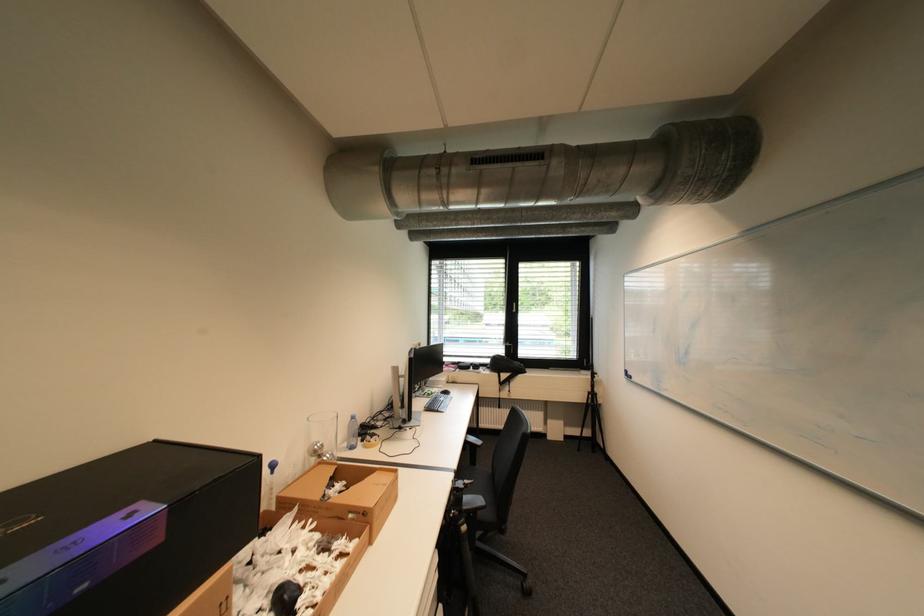
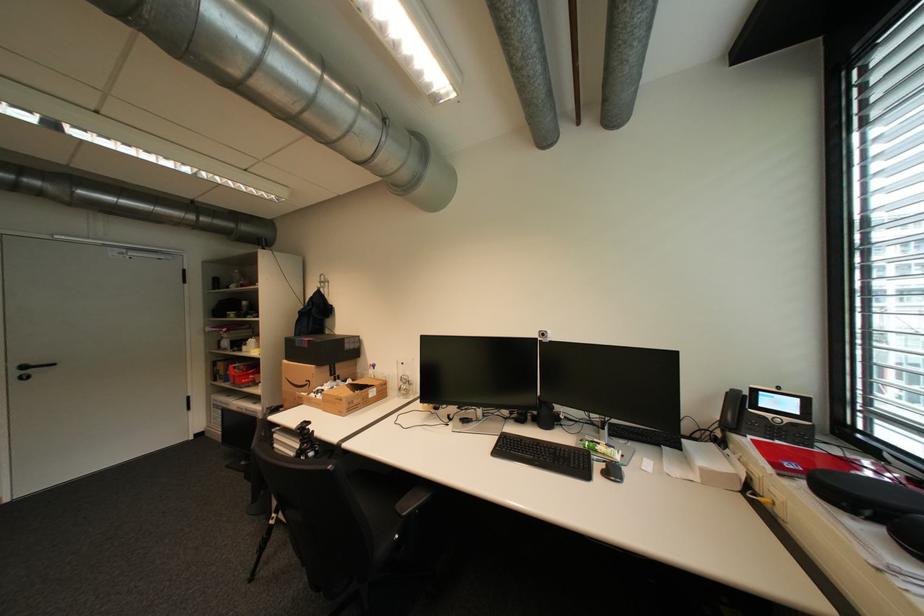
The point at (91, 586) is marked in the first image. Where is the corresponding point in the second image?

(310, 346)